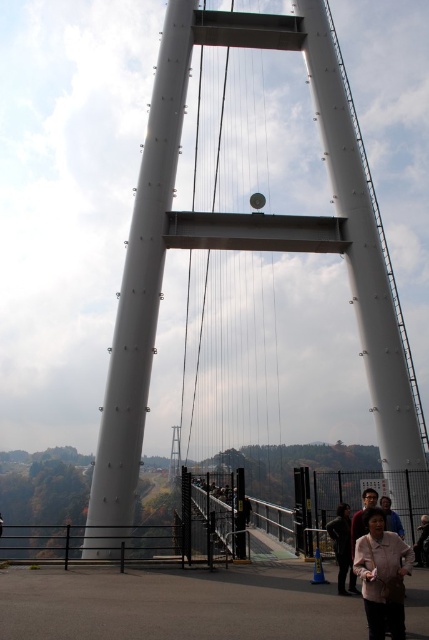
From the picture: Between light brown leather jacket at lower right and dark brown hair at center, which one has less height?

dark brown hair at center is shorter.

Is light brown leather jacket at lower right above dark brown hair at center?

No.

Is point (337, 544) positioned behind point (380, 497)?

No, it is in front of (380, 497).

I want to click on light brown leather jacket at lower right, so click(x=343, y=548).

The image size is (429, 640). What do you see at coordinates (383, 576) in the screenshot?
I see `pink fabric at lower center` at bounding box center [383, 576].

Does point (404, 632) come in front of point (392, 524)?

Yes, it is in front of point (392, 524).

Measure the distance between point (365, 548) and camera.

Point (365, 548) is 16.52 meters away from camera.

Identify the location of pink fabric at lower center. (383, 576).

Is white metallic suspension bridge at center thinner than dark brown leather jacket at lower right?

In fact, white metallic suspension bridge at center might be wider than dark brown leather jacket at lower right.

Between white metallic suspension bridge at center and dark brown leather jacket at lower right, which one appears on the left side from the viewer's perspective?

white metallic suspension bridge at center

Between point (362, 332) and point (420, 532), which one is positioned behind?

The point (362, 332) is behind.

In order to click on white metallic suspension bridge at center in this screenshot , I will do `click(242, 250)`.